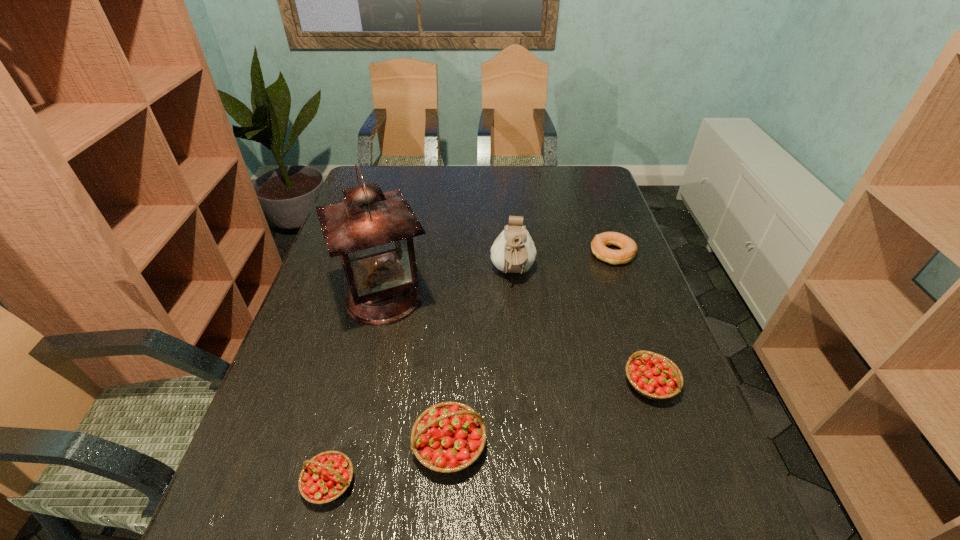
Identify the location of free space that satisfies the following two spatial constraints: 1. on the back side of the second strawberry from right to left; 2. on the left side of the leftmost strawberry. (339, 446).

Find the location of `vacant space that satisfies the following two spatial constraints: 1. on the back side of the rightmost strawberry; 2. on the right side of the shortest strawberry`. vacant space that satisfies the following two spatial constraints: 1. on the back side of the rightmost strawberry; 2. on the right side of the shortest strawberry is located at coordinates (354, 383).

You are a GUI agent. You are given a task and a screenshot of the screen. Output one action in this format:
    pyautogui.click(x=<x>, y=<y>)
    Task: Click on the vacant space that satisfies the following two spatial constraints: 1. on the back side of the second strawberry from right to left; 2. on the left side of the shortest strawberry
    The width and height of the screenshot is (960, 540).
    Given the screenshot: What is the action you would take?
    pyautogui.click(x=339, y=446)